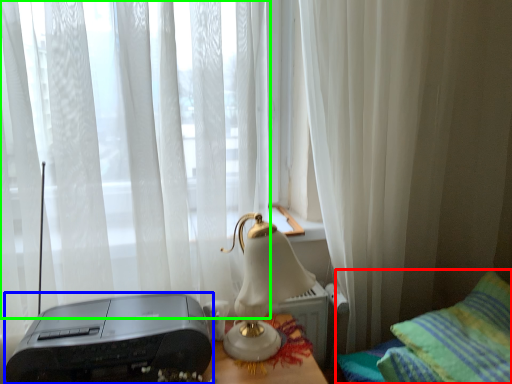
Question: Estimate the real-world distances between objects in this image. Which object is farther from furniture (highlighted by a red box), printer (highlighted by a blue box) or curtain (highlighted by a green box)?

Choices:
 (A) printer
 (B) curtain

Answer: (B)